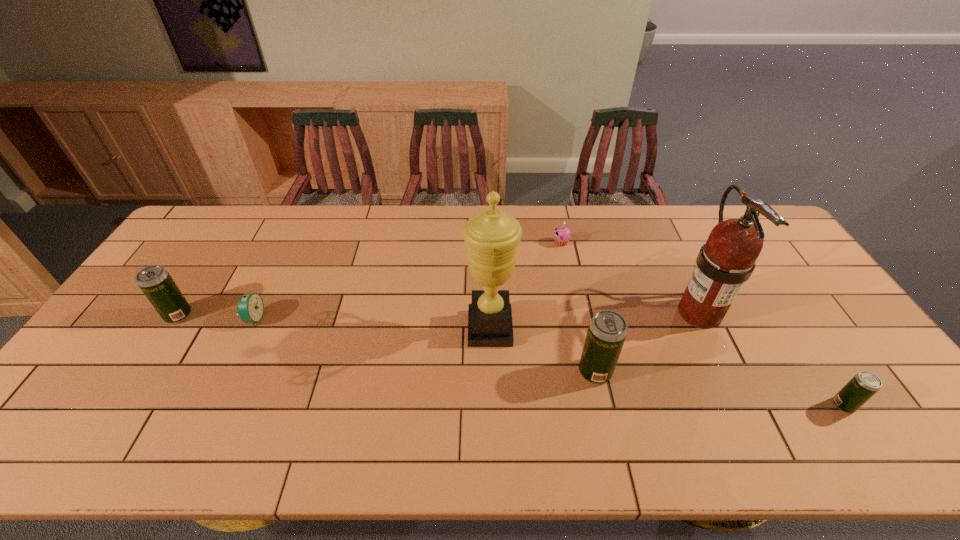
The height and width of the screenshot is (540, 960). Identify the location of vacant region located 0.180m on the right of the second beer can from left to right. (683, 372).

This screenshot has width=960, height=540. In order to click on vacant space located 0.050m on the back of the shortest beer can in this screenshot , I will do `click(826, 379)`.

Find the location of `vacant space located 0.340m on the front-facing side of the second object from left to right`. vacant space located 0.340m on the front-facing side of the second object from left to right is located at coordinates (382, 318).

Where is `vacant point located 0.050m at the nozzle of the second object from right to left`? vacant point located 0.050m at the nozzle of the second object from right to left is located at coordinates (722, 361).

Locate an element on the screen. Image resolution: width=960 pixels, height=540 pixels. free location located on the face of the farthest object is located at coordinates (470, 243).

In order to click on free space located 0.050m on the face of the farthest object in this screenshot , I will do `click(539, 243)`.

This screenshot has width=960, height=540. Identify the location of free space located 0.060m on the face of the farthest object. (536, 243).

You are a GUI agent. You are given a task and a screenshot of the screen. Output one action in this format:
    pyautogui.click(x=<x>, y=<y>)
    Task: Click on the free space located 0.340m at the front of the trophy cup with handles
    The image size is (960, 540).
    Given the screenshot: What is the action you would take?
    pyautogui.click(x=344, y=328)

Locate an element on the screen. free location located 0.200m at the front of the trophy cup with handles is located at coordinates (395, 328).

Locate an element on the screen. free region located at the front of the trophy cup with handles is located at coordinates (420, 328).